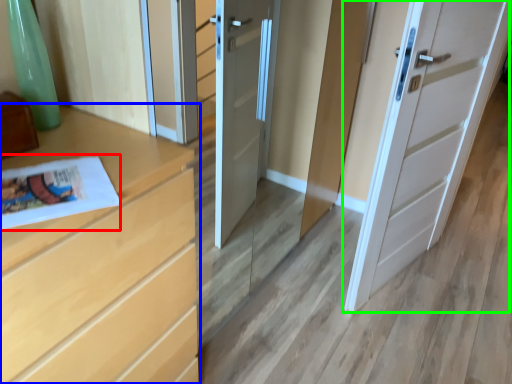
Question: Which is nearer to the magazine (highlighted by a red box)? chest of drawers (highlighted by a blue box) or door (highlighted by a green box).

Choices:
 (A) chest of drawers
 (B) door

Answer: (A)